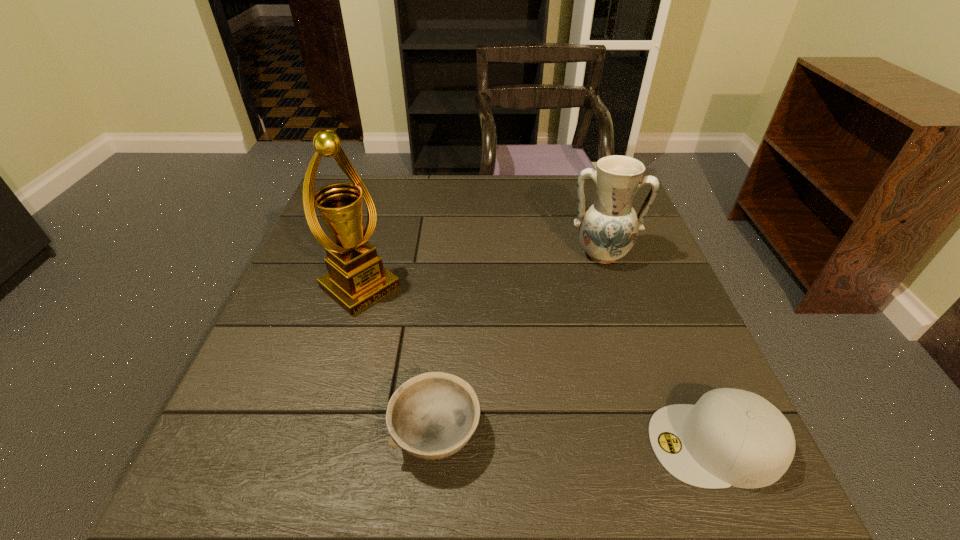
Locate an element on the screen. free space between the leftmost object and the bowl is located at coordinates (398, 361).

This screenshot has height=540, width=960. In order to click on free space between the second tallest object and the third tallest object in this screenshot , I will do `click(659, 349)`.

This screenshot has width=960, height=540. What are the coordinates of `free area in between the leftmost object and the cap` in the screenshot? It's located at (538, 366).

The width and height of the screenshot is (960, 540). Find the location of `vacant area that lies between the second tallest object and the cap`. vacant area that lies between the second tallest object and the cap is located at coordinates (659, 349).

In order to click on free spot between the cap and the leftmost object in this screenshot , I will do `click(538, 366)`.

The width and height of the screenshot is (960, 540). I want to click on free space that is in between the shortest object and the tallest object, so click(398, 361).

I want to click on object that is the second closest to the second tallest object, so click(x=433, y=415).

Point out which object is positioned as the third nearest to the third shortest object. Please provide its 2D coordinates. Your answer should be formatted as a tuple, i.e. [(x, y)], where the tuple contains the x and y coordinates of a point satisfying the conditions above.

[(356, 279)]

The image size is (960, 540). What are the coordinates of `vacant space that satisfies the following two spatial constraints: 1. on the front side of the second shortest object; 2. on the front-facing side of the pottery` in the screenshot? It's located at (662, 444).

This screenshot has height=540, width=960. In order to click on free space that satisfies the following two spatial constraints: 1. on the back side of the leftmost object; 2. on the right side of the third shortest object in this screenshot , I will do pos(370,255).